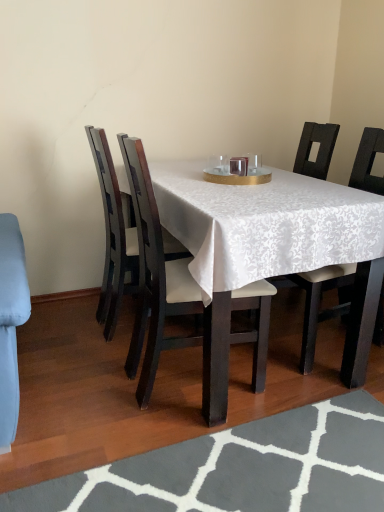
The height and width of the screenshot is (512, 384). What are the coordinates of `vacant area that is in front of dark wood chair at left, which is counted as the 1th chair, starting from the left` in the screenshot? It's located at (88, 368).